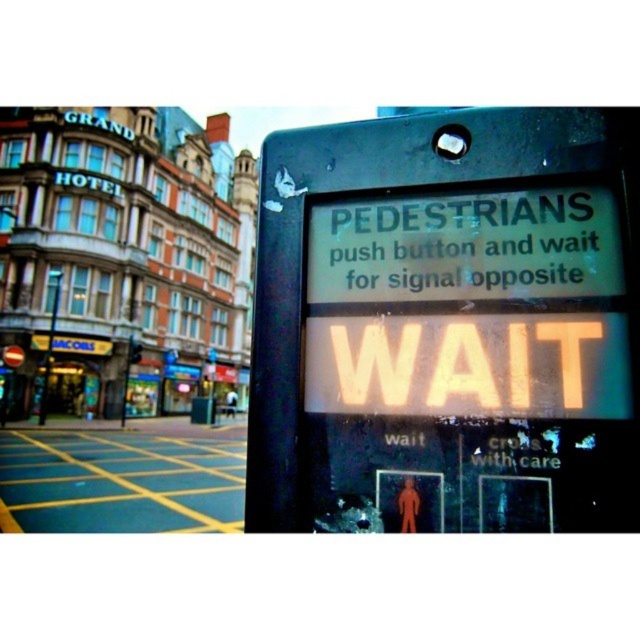
You are a delivery person with a cart that is 1.5 meters wide. You need to navigate between the black plastic pedestrian signal at center right and the black plastic pole at left. Can your cart fit through the space between them?

The distance between the black plastic pedestrian signal at center right and the black plastic pole at left is 72.35 meters, which is significantly wider than your cart. Therefore, your cart can easily fit through the space between them.

You are standing at the intersection and need to cross the street. There is a black plastic pedestrian signal at center right. Based on its location, can you estimate its position relative to the center of the image?

The black plastic pedestrian signal at center right is located at coordinates approximately 0.508 on the x axis and 0.700 on the y axis, which places it slightly to the right and above the center of the image.

You are standing at the pedestrian crossing signal near the Grand Hotel. You see two points marked on the ground at coordinates point (588, 188) and point (49, 358). Which point is closer to you from your current position?

Point (588, 188) is in front of point (49, 358), so it is closer to your current position.